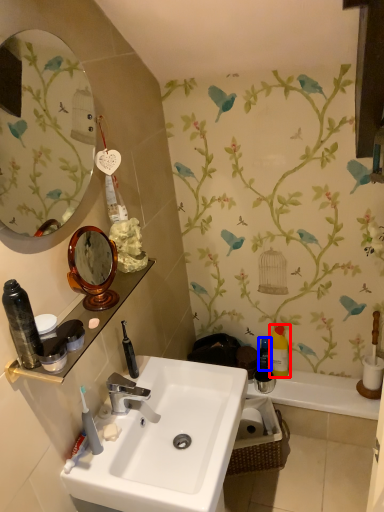
Question: Which object appears farthest to the camera in this image, toiletry (highlighted by a red box) or toiletry (highlighted by a blue box)?

Choices:
 (A) toiletry
 (B) toiletry

Answer: (B)